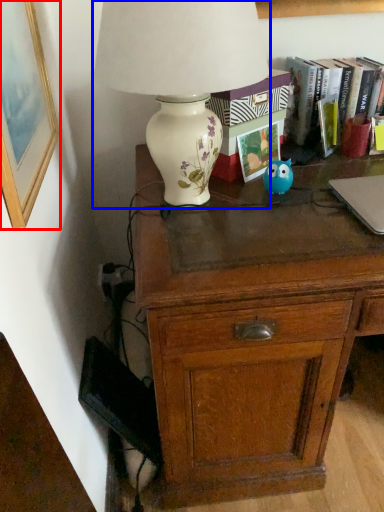
Question: Which object appears closest to the camera in this image, picture frame (highlighted by a red box) or lamp (highlighted by a blue box)?

Choices:
 (A) picture frame
 (B) lamp

Answer: (A)